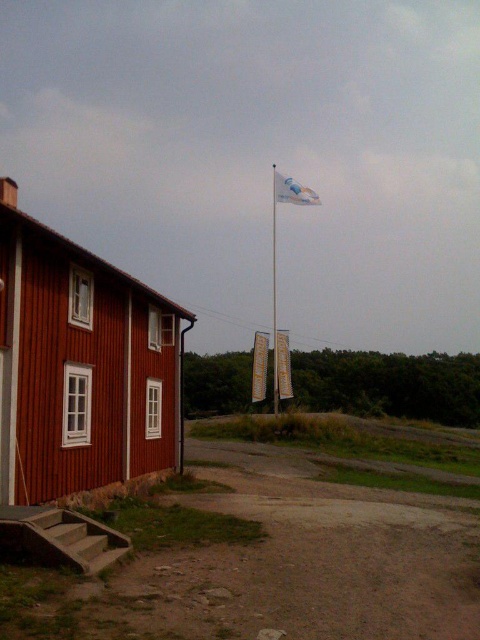
Question: Can you confirm if white glossy flag pole at center is positioned to the left of white fabric flag at upper center?

Choices:
 (A) yes
 (B) no

Answer: (A)

Question: Can you confirm if dirt at lower left is positioned to the right of white fabric flag at upper center?

Choices:
 (A) yes
 (B) no

Answer: (B)

Question: Estimate the real-world distances between objects in this image. Which object is farther from the wooden house at left?

Choices:
 (A) white fabric flag at upper center
 (B) dirt at lower left
 (C) yellow fabric sign at center

Answer: (A)

Question: Which is farther from the white glossy flag pole at center?

Choices:
 (A) white fabric flag at upper center
 (B) wooden house at left
 (C) yellow fabric banner at center

Answer: (B)

Question: Which point is farther from the camera taking this photo?

Choices:
 (A) (33, 490)
 (B) (300, 452)

Answer: (B)

Question: Considering the relative positions of dirt at lower left and wooden house at left in the image provided, where is dirt at lower left located with respect to wooden house at left?

Choices:
 (A) below
 (B) above

Answer: (A)